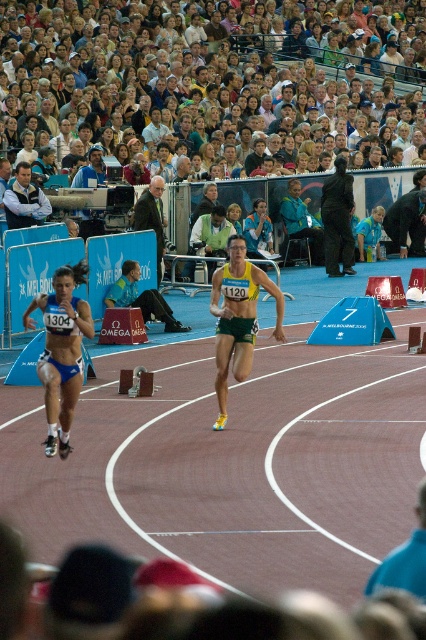
Can you confirm if light blue shirt at center is wider than light blue fabric jacket at upper center?

Indeed, light blue shirt at center has a greater width compared to light blue fabric jacket at upper center.

Does light blue shirt at center have a smaller size compared to light blue fabric jacket at upper center?

No.

Is point (8, 216) positioned behind point (123, 141)?

That is False.

Find the location of a particular element. light blue shirt at center is located at coordinates (25, 198).

Can you confirm if multicolored fabric crowd at upper center is positioned to the right of light blue fabric jacket at upper center?

Correct, you'll find multicolored fabric crowd at upper center to the right of light blue fabric jacket at upper center.

At what (x,y) coordinates should I click in order to perform the action: click on multicolored fabric crowd at upper center. Please return your answer as a coordinate pair (x, y). Looking at the image, I should click on (241, 28).

Is point (388, 36) positioned behind point (115, 152)?

Yes, it is behind point (115, 152).

This screenshot has height=640, width=426. I want to click on multicolored fabric crowd at upper center, so click(x=241, y=28).

Can you confirm if multicolored fabric crowd at upper center is shorter than matte blue bikini at left?

No, multicolored fabric crowd at upper center is not shorter than matte blue bikini at left.

Who is more forward, [391,4] or [68,330]?

Point [68,330] is in front.

The height and width of the screenshot is (640, 426). In order to click on multicolored fabric crowd at upper center in this screenshot , I will do `click(241, 28)`.